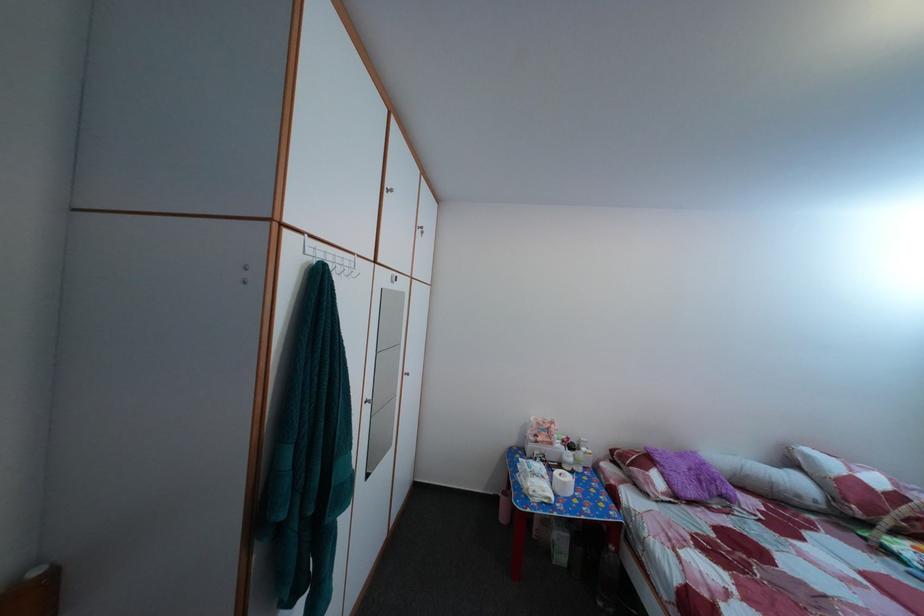
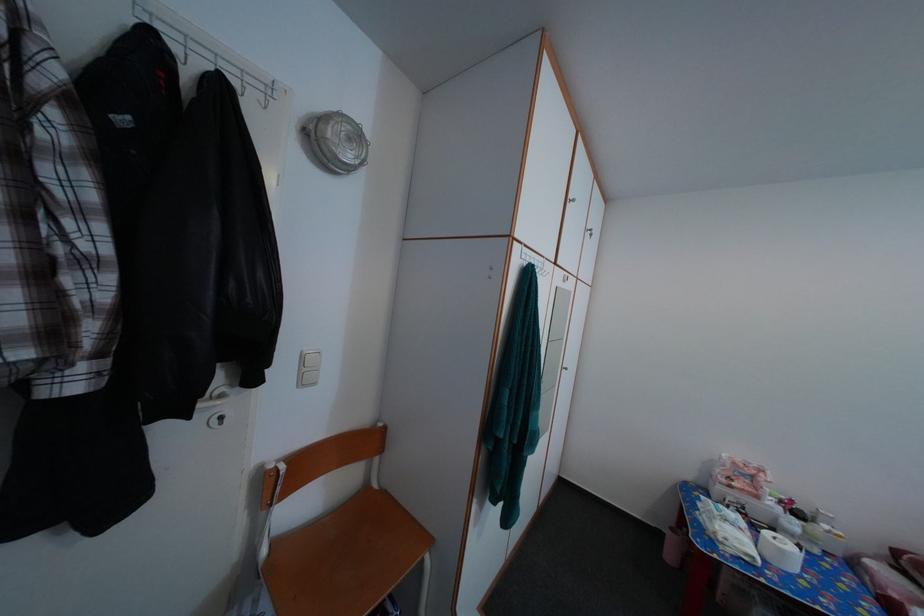
In the second image, find the point that corresponds to point 295,238 in the first image.

(525, 251)